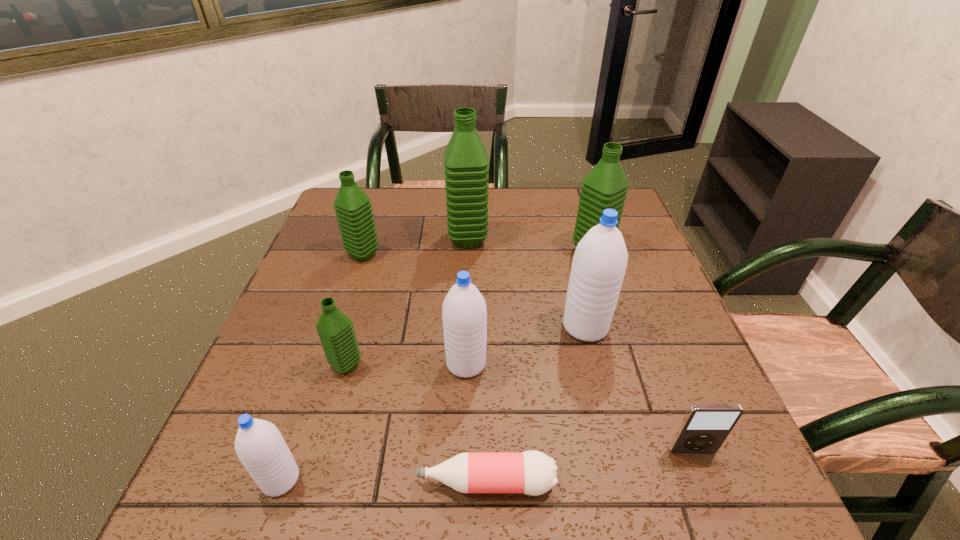
Where is `the nearest water bottle`? The height and width of the screenshot is (540, 960). the nearest water bottle is located at coordinates tap(260, 447).

Identify the location of iPod. This screenshot has height=540, width=960. (705, 427).

Locate an element on the screen. The image size is (960, 540). the seventh farthest object is located at coordinates [x=705, y=427].

The width and height of the screenshot is (960, 540). I want to click on the shortest object, so click(531, 472).

Find the location of `bottle`. bottle is located at coordinates (531, 472).

At what (x,y) coordinates should I click in order to perform the action: click on vacant space located on the back of the biggest green water bottle. Please return your answer as a coordinate pair (x, y). The height and width of the screenshot is (540, 960). Looking at the image, I should click on (469, 194).

Locate an element on the screen. The width and height of the screenshot is (960, 540). blank space located 0.140m on the back of the rightmost green water bottle is located at coordinates coord(580,212).

This screenshot has height=540, width=960. In order to click on free location located 0.160m on the front of the fourth nearest water bottle in this screenshot , I will do `click(606, 410)`.

Where is `vacant region located 0.290m on the back of the second smallest green water bottle`? This screenshot has width=960, height=540. vacant region located 0.290m on the back of the second smallest green water bottle is located at coordinates (384, 191).

This screenshot has height=540, width=960. I want to click on vacant space located 0.370m on the left of the second smallest blue water bottle, so click(266, 363).